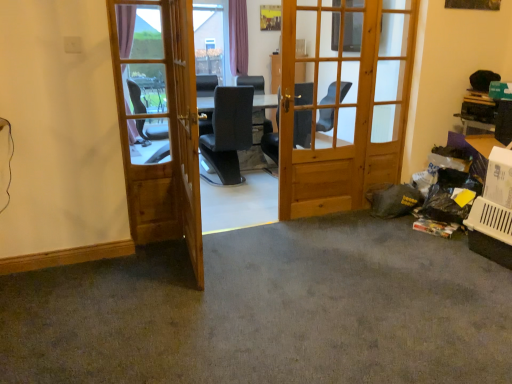
Question: From a real-world perspective, is wooden door at center, which ranks as the 1th door in right-to-left order, over gray carpet at lower right?

Choices:
 (A) no
 (B) yes

Answer: (B)

Question: Is wooden door at center, the second door when ordered from left to right, oriented away from gray carpet at lower right?

Choices:
 (A) no
 (B) yes

Answer: (A)

Question: Can you confirm if wooden door at center, which ranks as the 1th door in right-to-left order, is bigger than gray carpet at lower right?

Choices:
 (A) yes
 (B) no

Answer: (B)

Question: Is wooden door at center, which ranks as the 1th door in right-to-left order, closer to camera compared to gray carpet at lower right?

Choices:
 (A) no
 (B) yes

Answer: (A)

Question: Is wooden door at center, which ranks as the 1th door in right-to-left order, not inside gray carpet at lower right?

Choices:
 (A) no
 (B) yes

Answer: (B)

Question: Does wooden door at center, the second door when ordered from left to right, have a lesser height compared to gray carpet at lower right?

Choices:
 (A) no
 (B) yes

Answer: (A)

Question: Is wooden door at left, the second door positioned from the right, positioned beyond the bounds of gray carpet at lower right?

Choices:
 (A) no
 (B) yes

Answer: (B)

Question: Can you see wooden door at left, the second door positioned from the right, touching gray carpet at lower right?

Choices:
 (A) no
 (B) yes

Answer: (A)

Question: Can you confirm if wooden door at left, placed as the 1th door when sorted from left to right, is thinner than gray carpet at lower right?

Choices:
 (A) no
 (B) yes

Answer: (B)

Question: Can you confirm if wooden door at left, the second door positioned from the right, is shorter than gray carpet at lower right?

Choices:
 (A) no
 (B) yes

Answer: (A)

Question: From the image's perspective, would you say wooden door at left, placed as the 1th door when sorted from left to right, is shown under gray carpet at lower right?

Choices:
 (A) no
 (B) yes

Answer: (A)

Question: From the image's perspective, is wooden door at left, placed as the 1th door when sorted from left to right, on gray carpet at lower right?

Choices:
 (A) yes
 (B) no

Answer: (A)

Question: Is the position of wooden door at left, the second door positioned from the right, more distant than that of light brown wooden screen door at center?

Choices:
 (A) yes
 (B) no

Answer: (A)